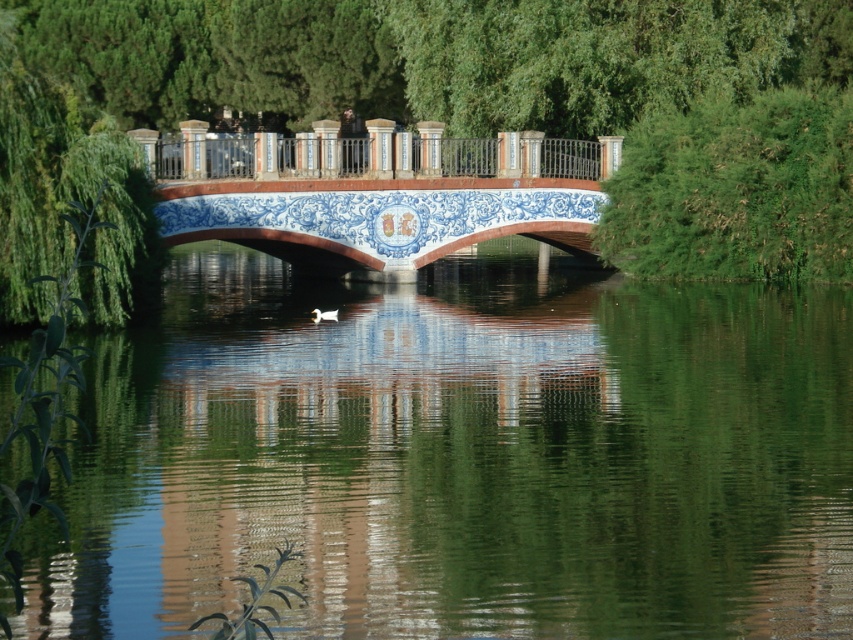
Who is more forward, (x=618, y=88) or (x=436, y=214)?

Point (x=436, y=214) is in front.

Is point (126, 61) closer to viewer compared to point (498, 168)?

No, (126, 61) is further to viewer.

I want to click on green leafy tree at center, so click(521, 97).

Is blue ceramic bridge at center smaller than metallic polished railing at center?

No, blue ceramic bridge at center is not smaller than metallic polished railing at center.

Is point (401, 240) in front of point (456, 145)?

Yes, point (401, 240) is in front of point (456, 145).

Is point (503, 156) positioned before point (323, 168)?

No, (503, 156) is behind (323, 168).

Image resolution: width=853 pixels, height=640 pixels. Find the location of `blue ceramic bridge at center`. blue ceramic bridge at center is located at coordinates (379, 193).

Is green leafy tree at center positioned at the back of metallic polished railing at center?

No, green leafy tree at center is in front of metallic polished railing at center.

Between point (381, 48) and point (461, 145), which one is positioned behind?

Positioned behind is point (381, 48).

Is point (683, 186) in front of point (213, 161)?

That is False.

Image resolution: width=853 pixels, height=640 pixels. Identify the location of green leafy tree at center. (521, 97).